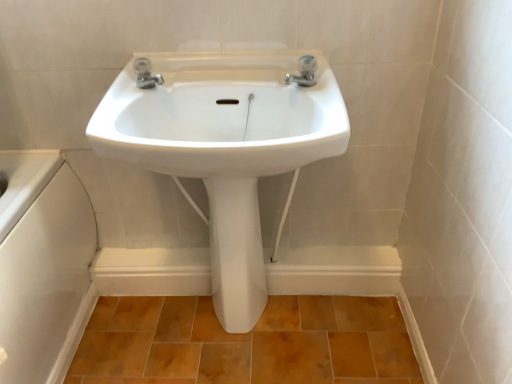
This screenshot has width=512, height=384. Identify the location of unoccupied space behind silver metallic tap at upper center, which is the second tap from left to right. (282, 71).